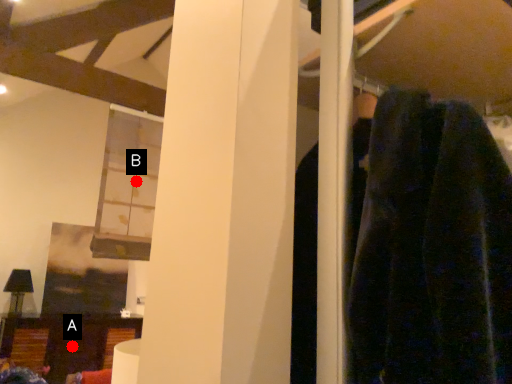
Question: Two points are circled on the image, labeled by A and B beside each circle. Which point is farther from the camera taking this photo?

Choices:
 (A) A is further
 (B) B is further

Answer: (A)